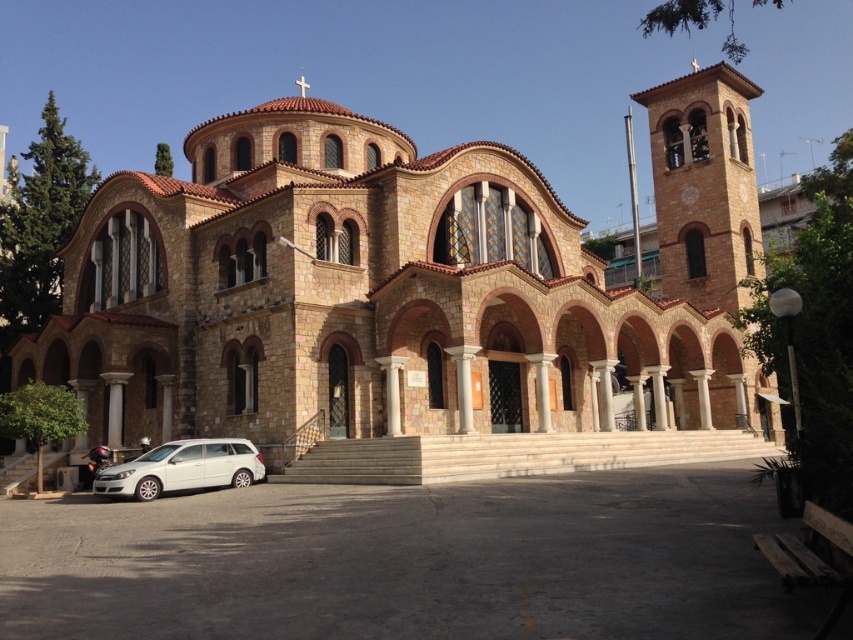
Can you confirm if brown stone church at center is positioned to the left of white matte station wagon at lower left?

In fact, brown stone church at center is to the right of white matte station wagon at lower left.

Find the location of `brown stone church at center`. brown stone church at center is located at coordinates (403, 285).